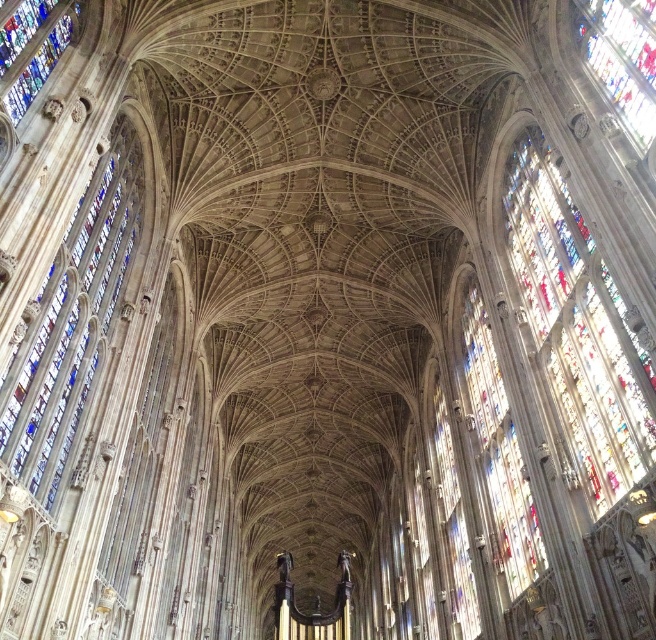
You are standing inside the cathedral and want to take a closer look at the multicolored stained glass at right. If you walk straight towards it, how far will you have to walk?

You will have to walk 63.45 meters to reach the multicolored stained glass at right.

You are standing inside the cathedral and want to take a photo of the multicolored stained glass at right and the stained glass window at upper right. Which one should you point your camera at first if you want to capture both in a single shot without moving the camera?

You should point your camera at the multicolored stained glass at right first because it is below the stained glass window at upper right, so capturing it first will ensure both are in the frame when adjusting the camera angle upwards.